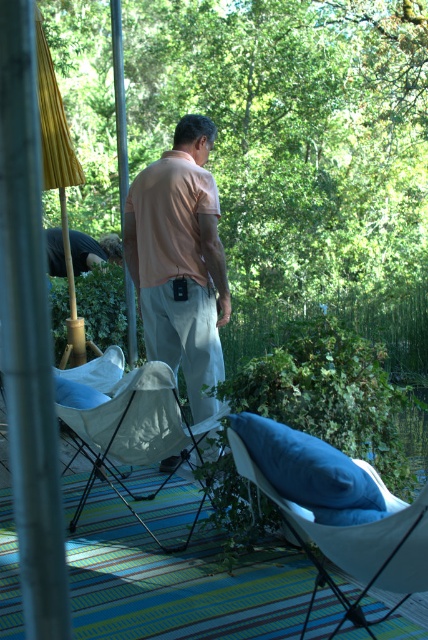
You are a photographer trying to capture a candid shot of the man in the scene. You notice the matte khaki pants at center and the metallic pole at upper center. Which object is closer to the camera, and how might this affect your composition?

The matte khaki pants at center is in front of the metallic pole at upper center, meaning the pants are closer to the camera. This proximity could cause the pole to appear partially obscured behind the pants in your photo, so you might need to adjust your angle to ensure both elements are clearly visible.

You are planning to place a rectangular box that is 1.2 meters wide on the striped rug. The blue soft pillow at lower center and the yellow woven umbrella at left are already on the rug. Which object on the rug has a greater width, allowing you to determine if the box can fit next to it?

The blue soft pillow at lower center has a greater width than the yellow woven umbrella at left. Since the blue soft pillow at lower center is wider, if the box is 1.2 meters wide, you should compare the pillow width to ensure there is enough space on the rug. However, without knowing the exact width of the pillow, it is impossible to definitively determine if the box will fit.

You are planning to set up a small table between the silver metallic pole at left and the yellow woven umbrella at left. Which object should the table be placed closer to in order to avoid blocking the path underneath the umbrella?

The table should be placed closer to the silver metallic pole at left because it is located below the yellow woven umbrella at left, so positioning the table near the pole would keep the path under the umbrella clear.